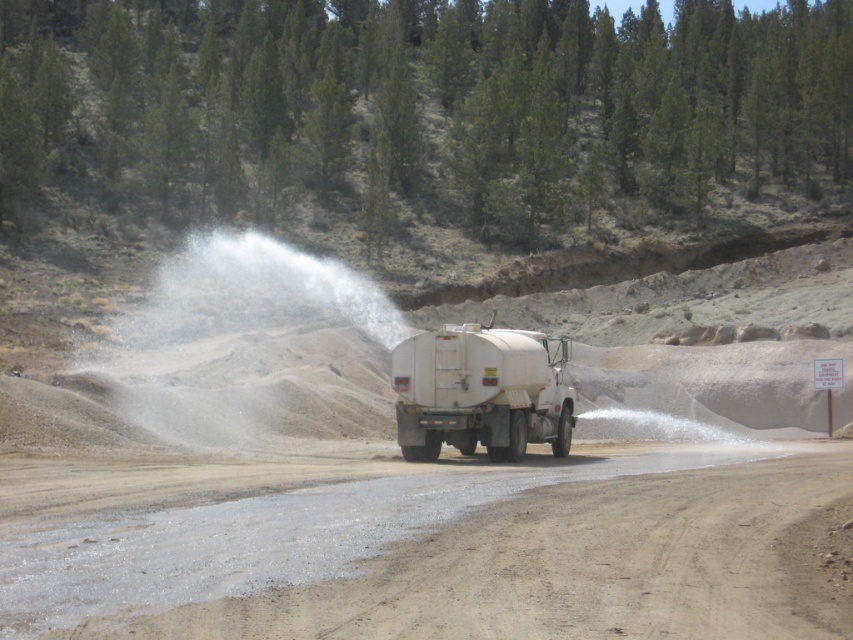
Which of these two, green textured pine forest at upper center or white powdery dust at center, stands shorter?

Standing shorter between the two is white powdery dust at center.

Who is more forward, (444, 184) or (300, 256)?

Point (300, 256)

Does point (119, 188) come farther from viewer compared to point (242, 378)?

Yes.

This screenshot has width=853, height=640. What are the coordinates of `green textured pine forest at upper center` in the screenshot? It's located at (424, 104).

Can you confirm if dull brown dirt track at center is smaller than white powdery dust at center?

Correct, dull brown dirt track at center occupies less space than white powdery dust at center.

Does dull brown dirt track at center have a greater width compared to white powdery dust at center?

Yes.

The height and width of the screenshot is (640, 853). Describe the element at coordinates (415, 547) in the screenshot. I see `dull brown dirt track at center` at that location.

Find the location of a particular element. The image size is (853, 640). dull brown dirt track at center is located at coordinates (415, 547).

Who is positioned more to the left, white powdery dust at center or white matte tanker truck at center?

Positioned to the left is white powdery dust at center.

Who is lower down, white powdery dust at center or white matte tanker truck at center?

Positioned lower is white matte tanker truck at center.

This screenshot has height=640, width=853. In order to click on white powdery dust at center in this screenshot , I will do `click(256, 346)`.

Where is `white powdery dust at center`? white powdery dust at center is located at coordinates (256, 346).